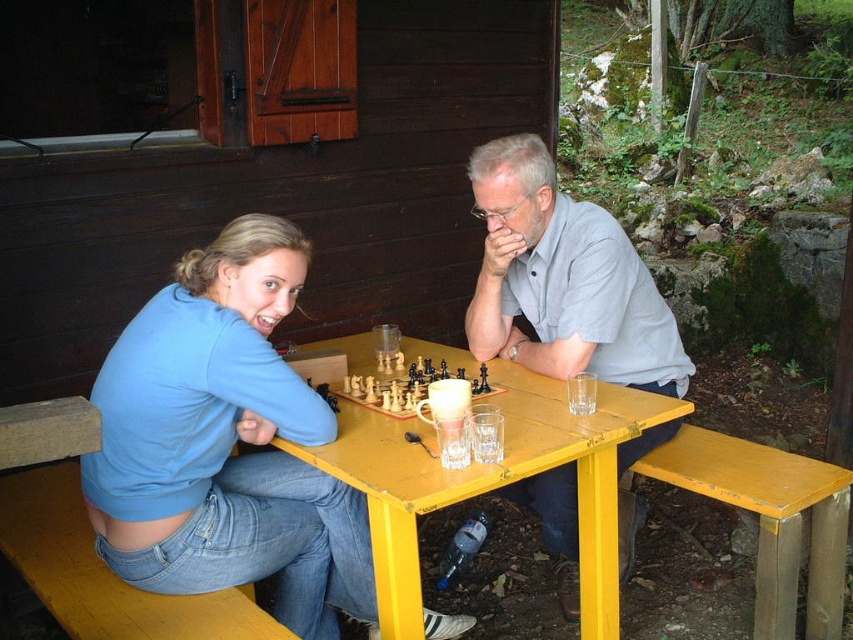
You are a photographer trying to capture a closeup of the wooden chess set at center without including the gray cotton shirt at center in the frame. Given their sizes, is this possible?

The gray cotton shirt at center is larger in size than the wooden chess set at center, so it might block the view of the wooden chess set at center. Adjust your angle or position to ensure the smaller wooden chess set at center is framed without the larger gray cotton shirt at center obstructing it.